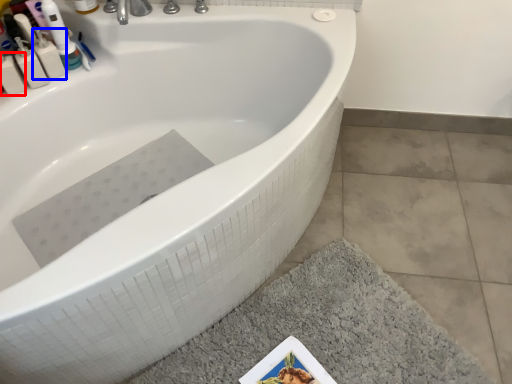
Question: Which object appears closest to the camera in this image, mouthwash (highlighted by a red box) or mouthwash (highlighted by a blue box)?

Choices:
 (A) mouthwash
 (B) mouthwash

Answer: (A)